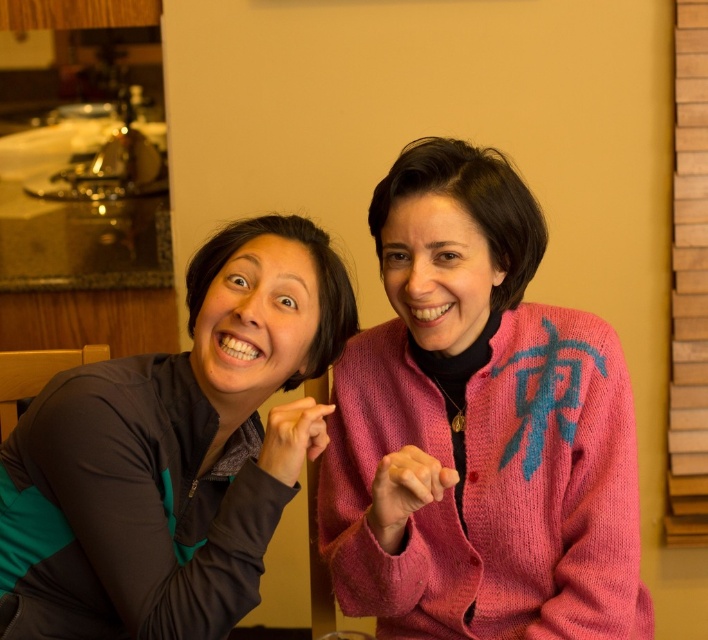
You are trying to decide which clothing item to take for a photoshoot. The scene shows two people in a kitchen. You need to choose between the pink knitted sweater at center and the teal fabric jacket at left. Which one is bigger in size?

The pink knitted sweater at center has a larger size compared to the teal fabric jacket at left, so you should choose the pink knitted sweater at center for the photoshoot.

You are standing in the kitchen and want to hand a dish from the dish rack to both the person wearing the pink knitted sweater at center and the teal fabric jacket at left. Which person should you approach first based on their proximity to you?

You should approach the pink knitted sweater at center first because it is closer to you than the teal fabric jacket at left, as the pink knitted sweater at center is further to the viewer than teal fabric jacket at left.

You are a tailor measuring the distance between two garments. The pink knitted sweater at center and the teal fabric jacket at left are on a rack. Can you fit a 25 cm wide box between them?

The pink knitted sweater at center and the teal fabric jacket at left are 26.11 centimeters apart, so yes, a 25 cm wide box can fit between them since the space is slightly larger than the box.